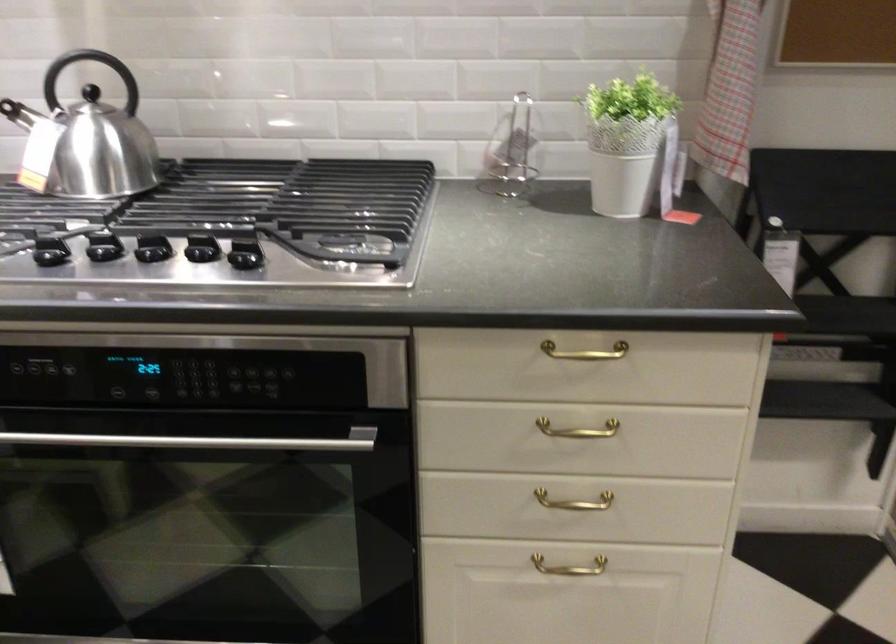
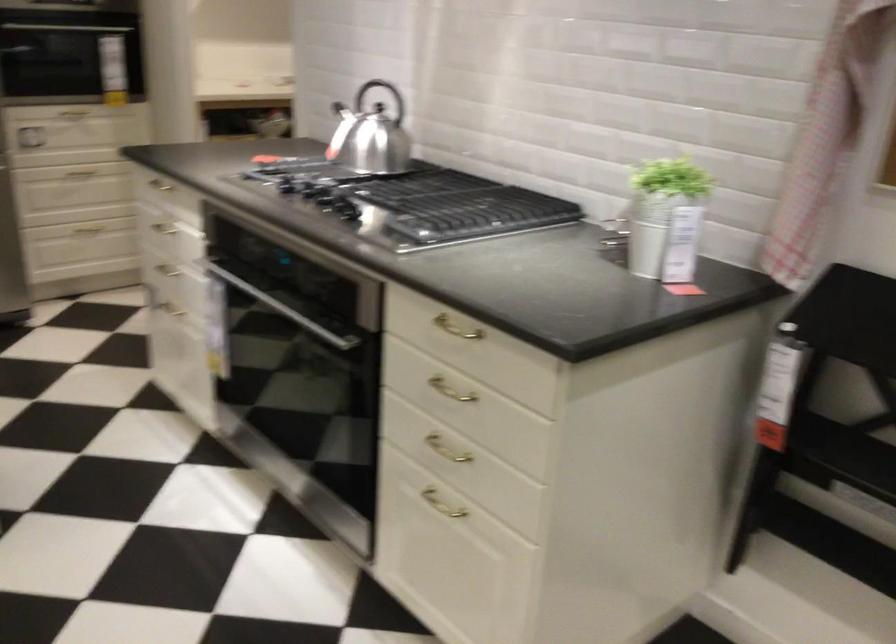
The point at [558,503] is marked in the first image. Where is the corresponding point in the second image?

(446, 448)